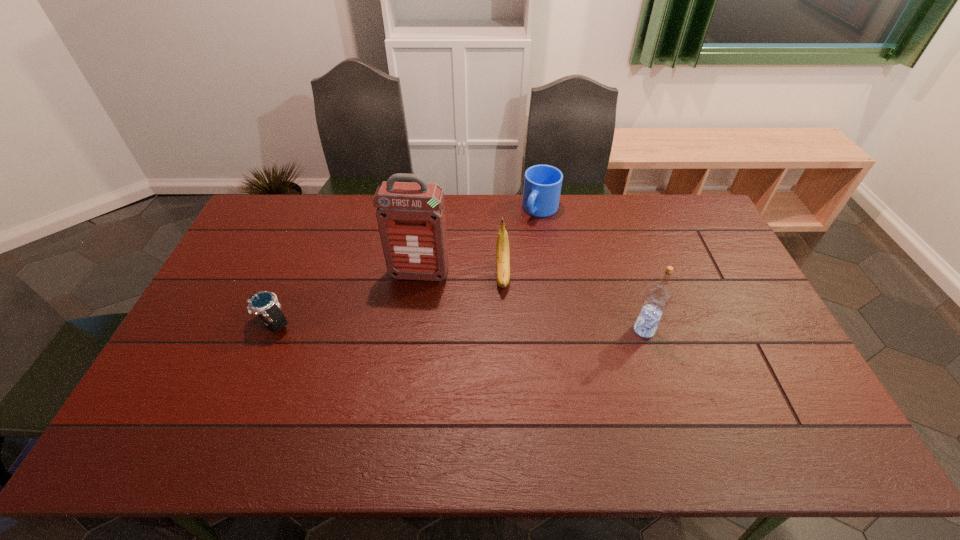
Where is `vacant space situated on the front-facing side of the second object from left to right`? Image resolution: width=960 pixels, height=540 pixels. vacant space situated on the front-facing side of the second object from left to right is located at coordinates (394, 374).

Identify the location of object present at the far edge. (542, 183).

The height and width of the screenshot is (540, 960). Identify the location of free space at the far edge of the desktop. (567, 219).

Locate an element on the screen. The image size is (960, 540). free space at the near edge of the desktop is located at coordinates [x=357, y=396].

Identify the location of vacant space at the right edge. This screenshot has height=540, width=960. (731, 346).

I want to click on vacant space at the far left corner of the desktop, so click(278, 197).

The height and width of the screenshot is (540, 960). Find the location of `free point at the far right corner`. free point at the far right corner is located at coordinates (656, 197).

This screenshot has height=540, width=960. I want to click on empty space between the leftmost object and the tallest object, so click(347, 299).

I want to click on free space between the banana and the vodka, so click(574, 302).

At what (x,y) coordinates should I click in order to perform the action: click on free space between the fourth object from left to right and the vodka. Please return your answer as a coordinate pair (x, y). Looking at the image, I should click on (592, 269).